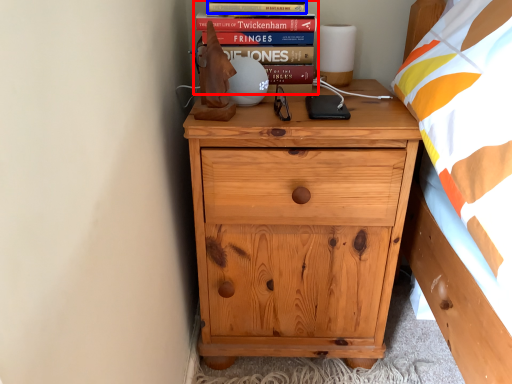
Question: Which point is further to the camera, book (highlighted by a red box) or paperback book (highlighted by a blue box)?

Choices:
 (A) book
 (B) paperback book

Answer: (A)